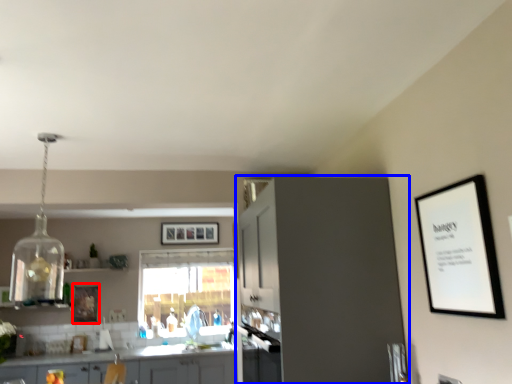
Question: Which point is closer to the camera, picture frame (highlighted by a red box) or cabinetry (highlighted by a blue box)?

Choices:
 (A) picture frame
 (B) cabinetry

Answer: (B)